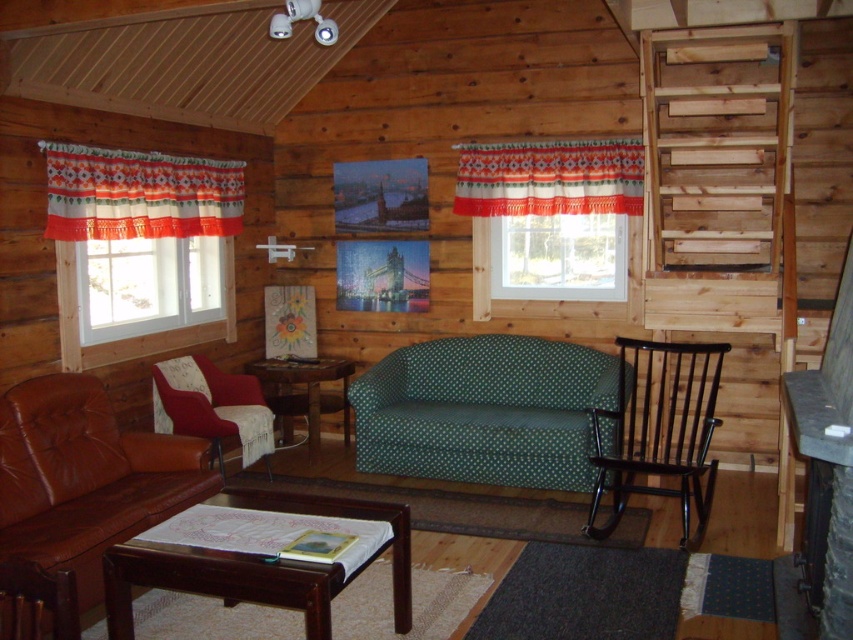
You are moving a large piece of furniture that is 7 feet long into this rustic cabin room. You need to place it between the black wood rocking chair at lower right and the velvet red armchair at lower left. Is there enough space between them to fit the furniture?

The black wood rocking chair at lower right is 6.83 feet from the velvet red armchair at lower left. Since the furniture is 7 feet long, it is slightly longer than the available space, so it will not fit between them.

In the scene shown: You are standing in the middle of the room and want to move to the window on the right. Which object, the black wood rocking chair at lower right or the velvet red armchair at lower left, is closer to your path?

The black wood rocking chair at lower right is closer to the viewer than the velvet red armchair at lower left, so it is closer to your path.

You are a guest in this cabin and want to know if the orange and white woven curtain at upper center can be reached by standing on the velvet red armchair at lower left. Can you reach it?

The orange and white woven curtain at upper center is not as tall as the velvet red armchair at lower left, so standing on the velvet red armchair at lower left would allow you to easily reach the curtain.